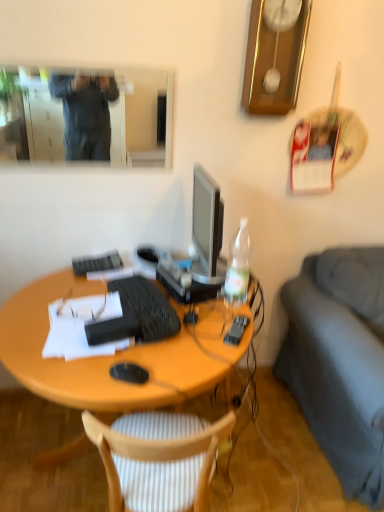
Question: Is matte black glasses at center far from black matte computer mouse at center?

Choices:
 (A) no
 (B) yes

Answer: (A)

Question: Is matte black glasses at center at the left side of black matte computer mouse at center?

Choices:
 (A) no
 (B) yes

Answer: (B)

Question: Is the depth of matte black glasses at center greater than that of black matte computer mouse at center?

Choices:
 (A) no
 (B) yes

Answer: (B)

Question: Is the depth of matte black glasses at center less than that of black matte computer mouse at center?

Choices:
 (A) no
 (B) yes

Answer: (A)

Question: Can black matte computer mouse at center be found inside matte black glasses at center?

Choices:
 (A) no
 (B) yes

Answer: (A)

Question: Can you confirm if matte black glasses at center is taller than black matte computer mouse at center?

Choices:
 (A) no
 (B) yes

Answer: (A)

Question: From the image's perspective, would you say matte black glasses at center is positioned over black matte keyboard at center, which appears as the second computer keyboard when viewed from the top?

Choices:
 (A) yes
 (B) no

Answer: (A)

Question: Could you tell me if matte black glasses at center is turned towards black matte keyboard at center, which is the first computer keyboard from front to back?

Choices:
 (A) yes
 (B) no

Answer: (B)

Question: From the image's perspective, is matte black glasses at center under black matte keyboard at center, which ranks as the 1th computer keyboard in right-to-left order?

Choices:
 (A) yes
 (B) no

Answer: (B)

Question: Considering the relative positions of matte black glasses at center and black matte keyboard at center, which is the second computer keyboard in back-to-front order, in the image provided, is matte black glasses at center to the left of black matte keyboard at center, which is the second computer keyboard in back-to-front order, from the viewer's perspective?

Choices:
 (A) no
 (B) yes

Answer: (B)

Question: From a real-world perspective, does matte black glasses at center sit lower than black matte keyboard at center, which ranks as the 2th computer keyboard in left-to-right order?

Choices:
 (A) no
 (B) yes

Answer: (A)

Question: Is matte black glasses at center touching black matte keyboard at center, which ranks as the 1th computer keyboard in right-to-left order?

Choices:
 (A) yes
 (B) no

Answer: (B)

Question: Is black plastic remote control at right wider than white paper at center?

Choices:
 (A) no
 (B) yes

Answer: (A)